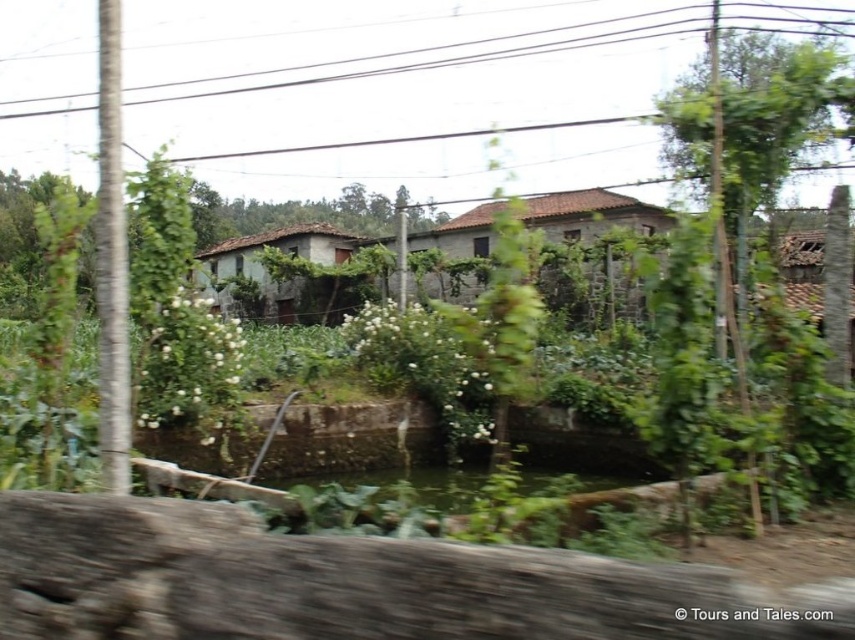
You are a painter standing in front of the stone wall, looking at the black wire at upper center and the rustic stone house at center. Which object would appear larger in your painting?

The black wire at upper center appears larger than the rustic stone house at center in the painting because it is described as bigger.

You are standing in the rural scene described. There is a black wire marked at point (458, 58). Where is this black wire located relative to the stone houses and garden?

The black wire at point (458, 58) is located at the upper center of the image, above the stone houses and garden.

You are a delivery drone with a wingspan of 1.5 meters. You need to fly between the stone textured house at center and the rustic stone house at center to deliver a package. Can you safely pass through the space between them without touching either house?

The stone textured house at center and rustic stone house at center are 8.57 meters apart from each other. Since the drone has a wingspan of 1.5 meters, there is sufficient space for it to pass safely between them without any issues.